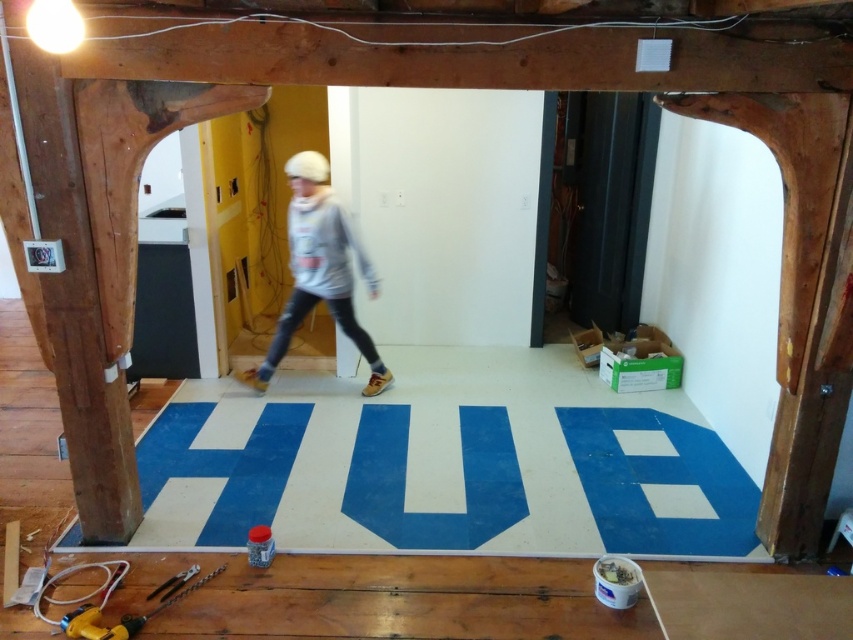
Question: Which point is farther to the camera?

Choices:
 (A) (370, 387)
 (B) (193, 566)

Answer: (A)

Question: Is gray fleece sweatshirt at center wider than metallic silver pliers at lower left?

Choices:
 (A) yes
 (B) no

Answer: (A)

Question: Can you confirm if gray fleece sweatshirt at center is positioned to the left of metallic silver pliers at lower left?

Choices:
 (A) yes
 (B) no

Answer: (B)

Question: Which point is farther to the camera?

Choices:
 (A) gray fleece sweatshirt at center
 (B) metallic silver pliers at lower left

Answer: (A)

Question: Does gray fleece sweatshirt at center have a lesser width compared to metallic silver pliers at lower left?

Choices:
 (A) no
 (B) yes

Answer: (A)

Question: Which of the following is the closest to the observer?

Choices:
 (A) (154, 593)
 (B) (312, 243)

Answer: (A)